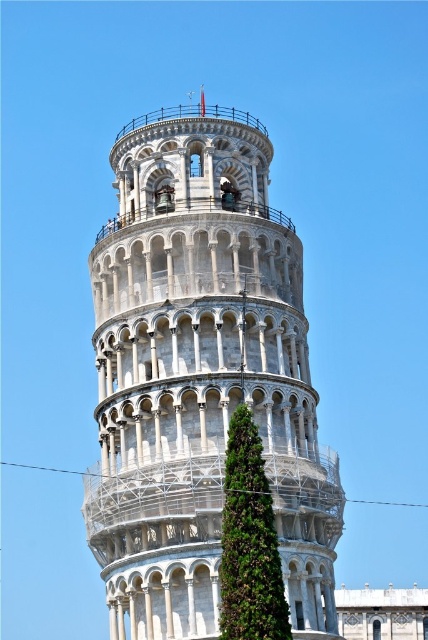
Question: Can you confirm if white stone tower at center is smaller than green leafy tree at center?

Choices:
 (A) no
 (B) yes

Answer: (A)

Question: Considering the relative positions of white stone tower at center and green leafy tree at center in the image provided, where is white stone tower at center located with respect to green leafy tree at center?

Choices:
 (A) right
 (B) left

Answer: (B)

Question: Which object is closer to the camera taking this photo?

Choices:
 (A) green leafy tree at center
 (B) white stone tower at center

Answer: (A)

Question: Can you confirm if white stone tower at center is bigger than green leafy tree at center?

Choices:
 (A) no
 (B) yes

Answer: (B)

Question: Among these points, which one is farthest from the camera?

Choices:
 (A) [x=180, y=616]
 (B) [x=265, y=560]

Answer: (A)